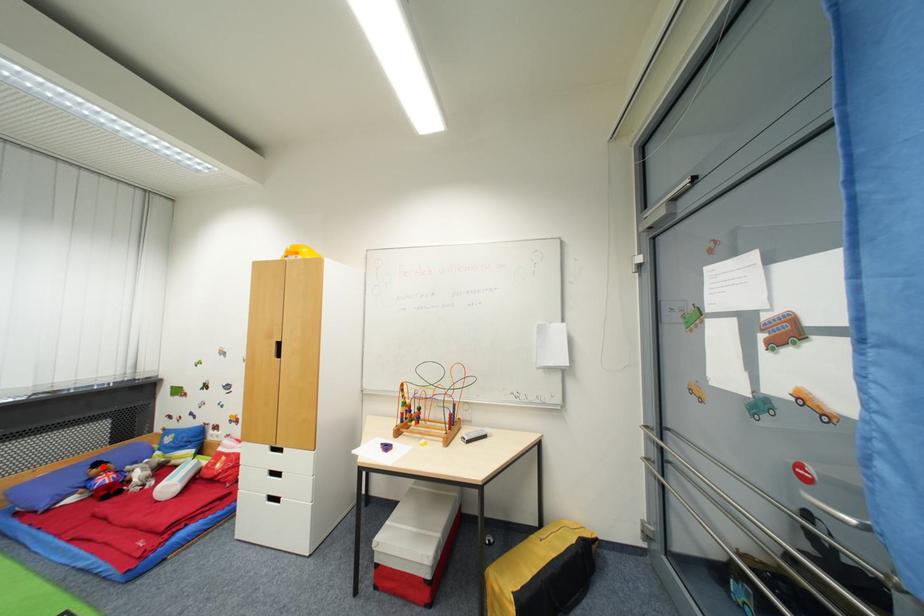
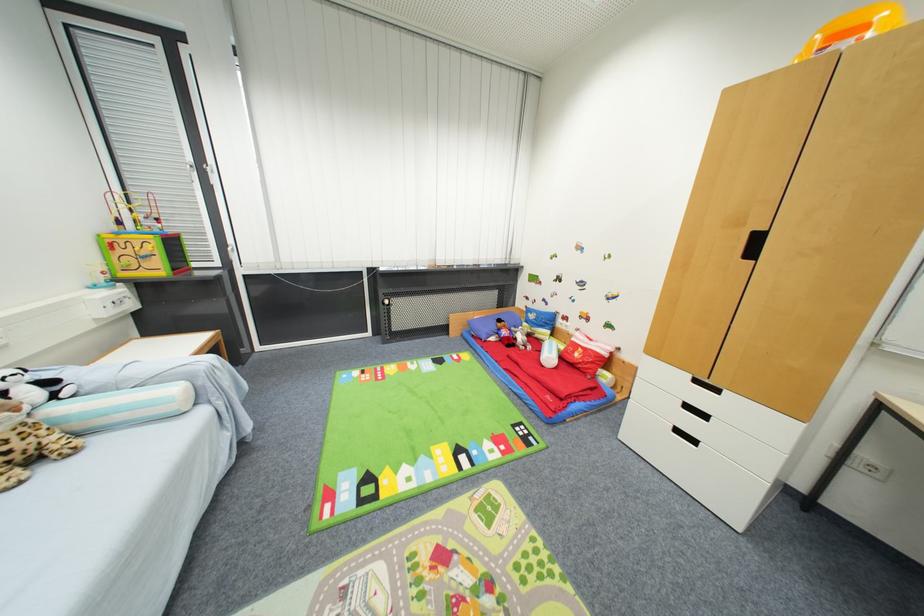
Question: I am providing you with two images of the same scene from different viewpoints. Given a red point in image1, look at the same physical point in image2. Is it:

Choices:
 (A) Closer to the viewpoint
 (B) Farther from the viewpoint

Answer: (B)